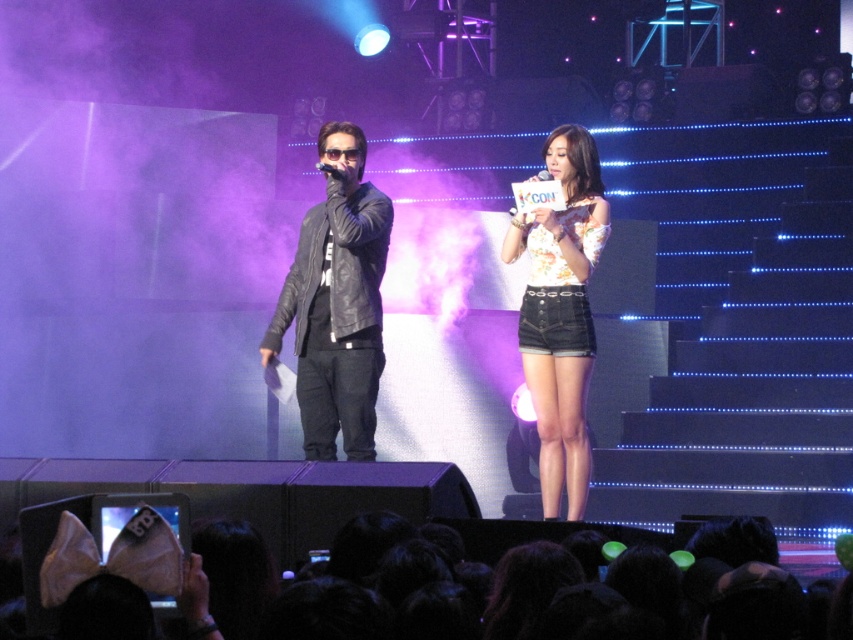
Based on the photo, which is below, floral fabric top at center or black leather microphone at center?

floral fabric top at center is lower down.

Does point (550, 452) lie in front of point (337, 177)?

No, (550, 452) is further to viewer.

At what (x,y) coordinates should I click in order to perform the action: click on floral fabric top at center. Please return your answer as a coordinate pair (x, y). Looking at the image, I should click on (561, 312).

Is point (543, 323) in front of point (541, 170)?

That is True.

Between floral fabric top at center and matte black microphone at center, which one is positioned lower?

floral fabric top at center is lower down.

Between point (604, 241) and point (549, 176), which one is positioned behind?

Positioned behind is point (549, 176).

Identify the location of floral fabric top at center. (561, 312).

Looking at this image, does leather jacket at center appear on the left side of black leather microphone at center?

Indeed, leather jacket at center is positioned on the left side of black leather microphone at center.

Who is positioned more to the left, leather jacket at center or black leather microphone at center?

leather jacket at center

Locate an element on the screen. The width and height of the screenshot is (853, 640). leather jacket at center is located at coordinates (335, 304).